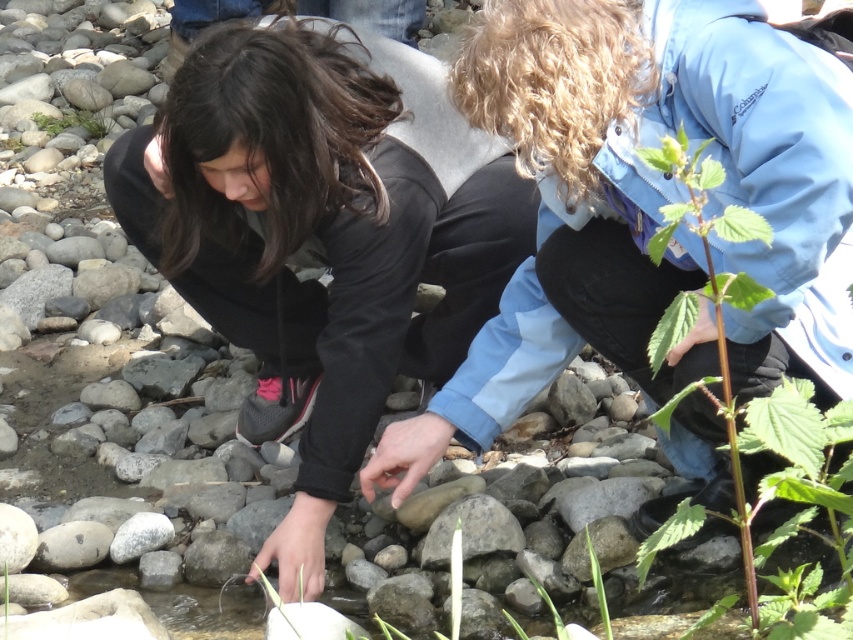
Question: Which of these objects is positioned farthest from the black matte jacket at center?

Choices:
 (A) green leafy stem at center right
 (B) green leafy plant at upper left

Answer: (B)

Question: Can you confirm if black matte jacket at center is positioned to the left of green leafy plant at upper left?

Choices:
 (A) yes
 (B) no

Answer: (B)

Question: Based on their relative distances, which object is farther from the black matte jacket at center?

Choices:
 (A) green leafy plant at upper left
 (B) green leafy stem at center right

Answer: (A)

Question: Which of these objects is positioned closest to the green leafy stem at center right?

Choices:
 (A) black matte jacket at center
 (B) green leafy plant at upper left

Answer: (A)

Question: Can you confirm if black matte jacket at center is thinner than green leafy stem at center right?

Choices:
 (A) no
 (B) yes

Answer: (A)

Question: Is black matte jacket at center below green leafy plant at upper left?

Choices:
 (A) no
 (B) yes

Answer: (B)